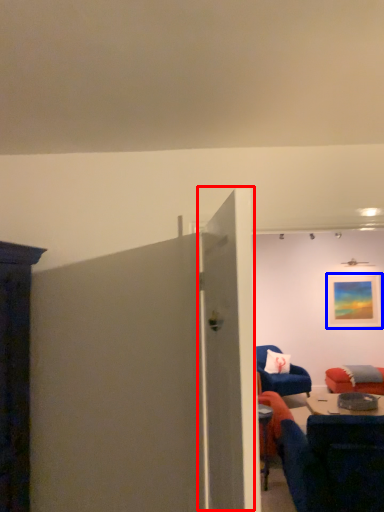
Question: Which object appears closest to the camera in this image, door (highlighted by a red box) or picture frame (highlighted by a blue box)?

Choices:
 (A) door
 (B) picture frame

Answer: (A)